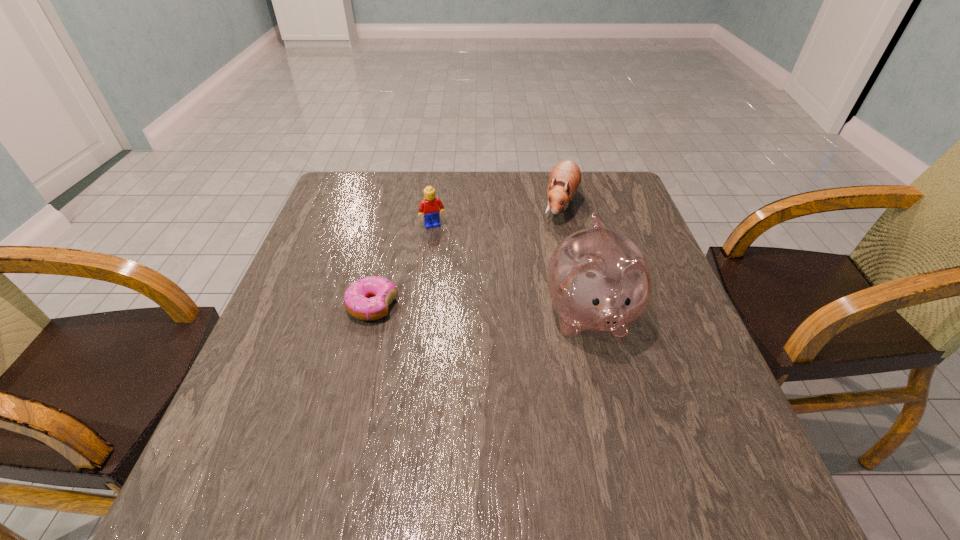
The width and height of the screenshot is (960, 540). I want to click on free space on the desktop that is between the shortest object and the piggy bank and is positioned at the face of the hamster, so (492, 311).

The image size is (960, 540). What are the coordinates of `vacant space on the desktop that is between the doughnut and the tallest object and is positioned on the front-facing side of the third object from right to left` in the screenshot? It's located at (464, 310).